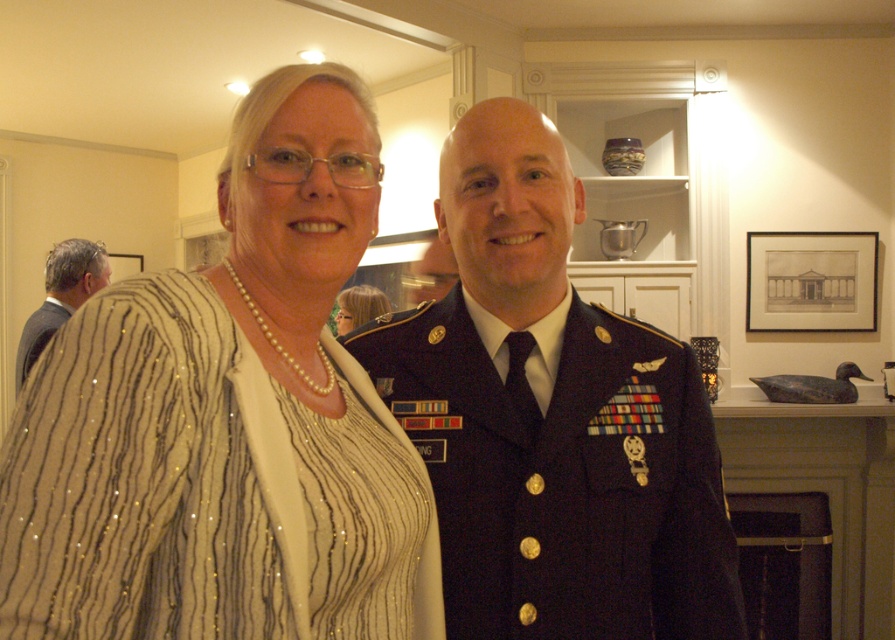
Consider the image. You are a photographer trying to capture a clear photo of the navy blue uniform at center and the satin black uniform at center. Since both are in the same frame, which one do you need to focus on first to ensure it appears sharp?

The navy blue uniform at center is in front of the satin black uniform at center, so you should focus on the navy blue uniform at center first to ensure it appears sharp.

You are an event planner arranging a photo shoot. You need to place a small podium between the dark suit at left and the pearl necklace at upper center. Where should you place it so it doesn

The dark suit at left is positioned under the pearl necklace at upper center, so placing the podium between them would require positioning it below the pearl necklace at upper center and above the dark suit at left to maintain spatial alignment.

You are an event planner arranging a photo shoot. You need to position a light source to the right of the pearl necklace at upper center. Will the light be to the right or left of the dark suit at left?

The dark suit at left is to the left of the pearl necklace at upper center. Placing the light to the right of the pearl necklace at upper center means it will be to the right of the dark suit at left as well.